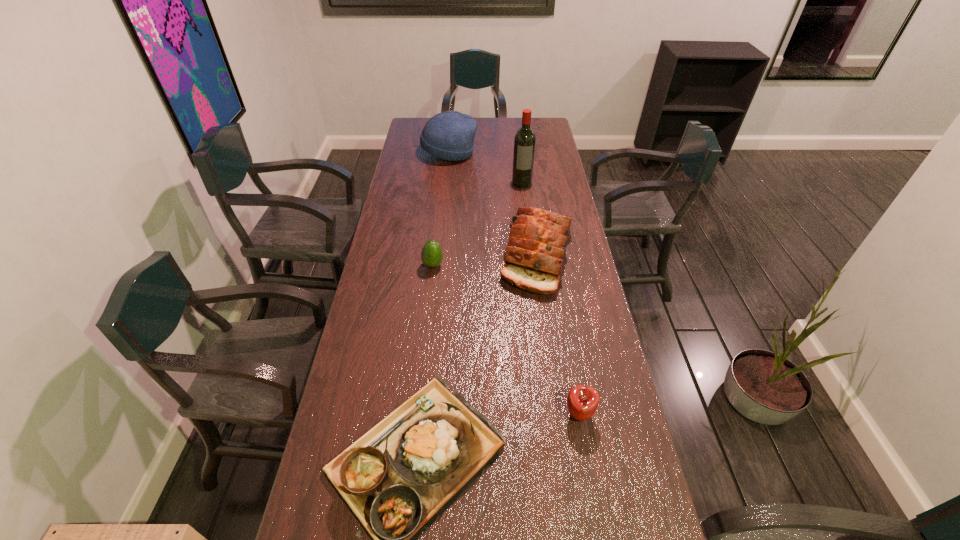
At what (x,y) coordinates should I click in order to perform the action: click on free space located on the right of the avocado. Please return your answer as a coordinate pair (x, y). The width and height of the screenshot is (960, 540). Looking at the image, I should click on (493, 265).

You are a GUI agent. You are given a task and a screenshot of the screen. Output one action in this format:
    pyautogui.click(x=<x>, y=<y>)
    Task: Click on the free space located on the front of the apple
    Image resolution: width=960 pixels, height=540 pixels.
    Given the screenshot: What is the action you would take?
    pos(588,463)

You are a GUI agent. You are given a task and a screenshot of the screen. Output one action in this format:
    pyautogui.click(x=<x>, y=<y>)
    Task: Click on the object located in the left edge section of the desktop
    
    Given the screenshot: What is the action you would take?
    pyautogui.click(x=449, y=135)

At what (x,y) coordinates should I click in order to perform the action: click on wine bottle located in the right edge section of the desktop. Please return your answer as a coordinate pair (x, y). This screenshot has width=960, height=540. Looking at the image, I should click on (524, 143).

Identify the location of bread that is at the right edge. (534, 255).

The width and height of the screenshot is (960, 540). Find the location of `apple positioned at the right edge`. apple positioned at the right edge is located at coordinates (582, 401).

Find the location of a particular element. This screenshot has width=960, height=540. blank space at the far edge of the desktop is located at coordinates (493, 126).

In the image, there is a desktop. Where is `free space at the left edge`? The width and height of the screenshot is (960, 540). free space at the left edge is located at coordinates (424, 200).

In the image, there is a desktop. Where is `free space at the right edge`? free space at the right edge is located at coordinates (541, 166).

In the image, there is a desktop. In order to click on free space at the far left corner in this screenshot , I will do `click(417, 130)`.